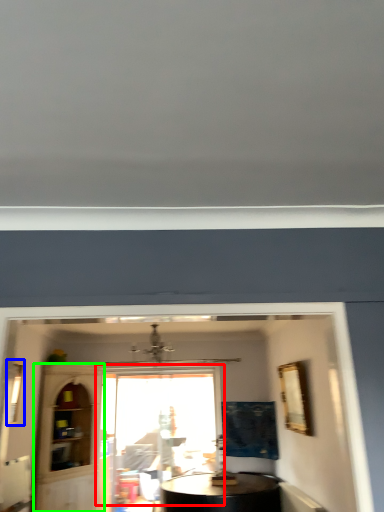
Question: Which object is the closest to the window (highlighted by a red box)? Choose among these: window (highlighted by a blue box) or glass door (highlighted by a green box).

Choices:
 (A) window
 (B) glass door

Answer: (B)